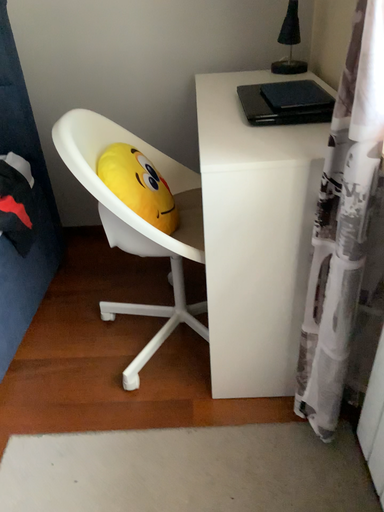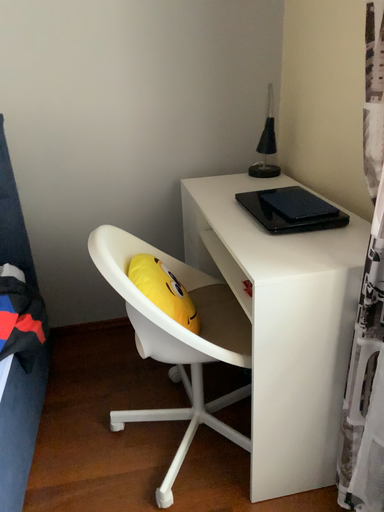
Question: Which way did the camera rotate in the video?

Choices:
 (A) rotated upward
 (B) rotated downward

Answer: (A)